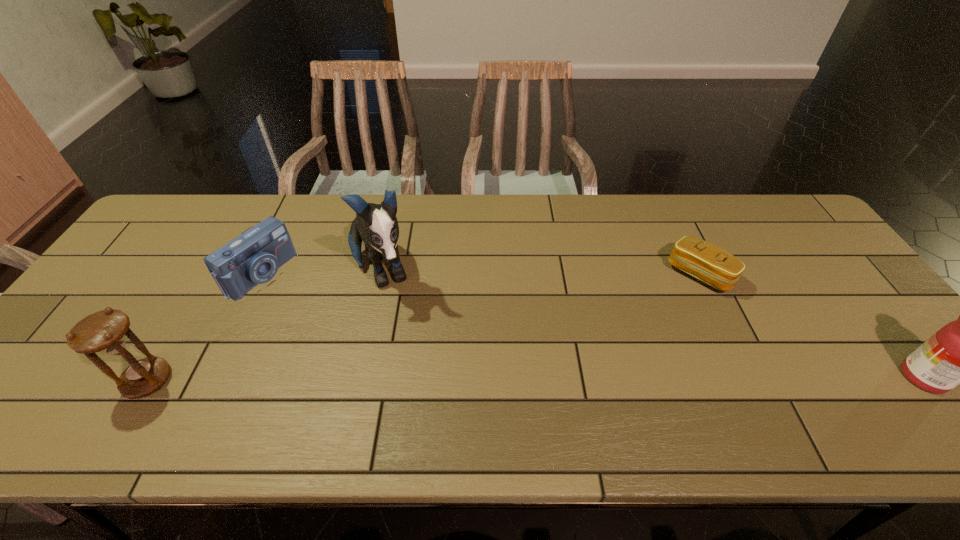
This screenshot has width=960, height=540. I want to click on free space on the desktop that is between the third tallest object and the fourth shortest object and is positioned on the lens of the fourth tallest object, so click(x=438, y=379).

This screenshot has width=960, height=540. I want to click on vacant space on the desktop that is between the leftmost object and the second tallest object and is positioned on the zipper side of the clutch bag, so click(x=585, y=379).

The height and width of the screenshot is (540, 960). I want to click on free space on the desktop that is between the third shortest object and the second tallest object and is positioned on the front-facing side of the third object from right to left, so click(420, 379).